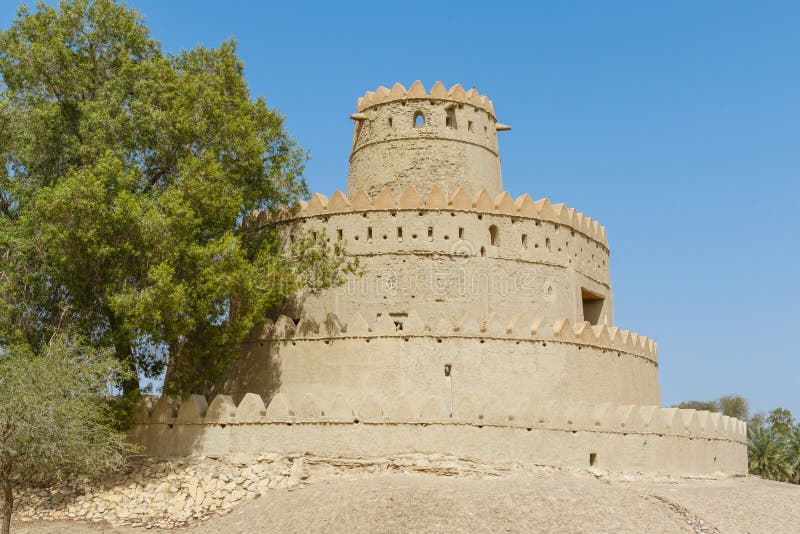
Locate an element on the screen. The height and width of the screenshot is (534, 800). doorway large is located at coordinates (598, 298).